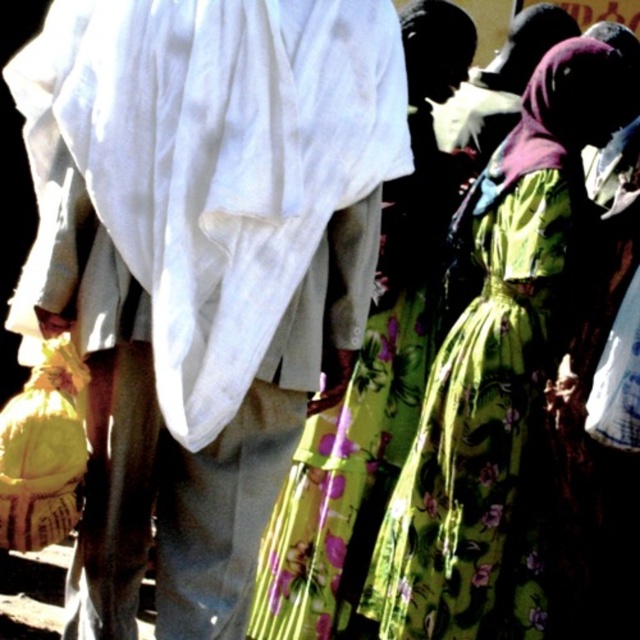
Does point (486, 538) come behind point (404, 236)?

That is False.

Can you confirm if floral green dress at center is wider than floral fabric dress at center?

Yes.

Where is `floral green dress at center`? The width and height of the screenshot is (640, 640). floral green dress at center is located at coordinates (497, 371).

You are a GUI agent. You are given a task and a screenshot of the screen. Output one action in this format:
    pyautogui.click(x=<x>, y=<y>)
    Task: Click on the floral green dress at center
    
    Given the screenshot: What is the action you would take?
    pyautogui.click(x=497, y=371)

Does white cotton cloth at center appear on the left side of floral green dress at center?

Yes, white cotton cloth at center is to the left of floral green dress at center.

Which of these two, white cotton cloth at center or floral green dress at center, stands taller?

floral green dress at center is taller.

You are a GUI agent. You are given a task and a screenshot of the screen. Output one action in this format:
    pyautogui.click(x=<x>, y=<y>)
    Task: Click on the white cotton cloth at center
    
    Given the screenshot: What is the action you would take?
    pyautogui.click(x=202, y=266)

Consider the image. Does white cotton cloth at center appear over floral fabric dress at center?

Incorrect, white cotton cloth at center is not positioned above floral fabric dress at center.

Is white cotton cloth at center to the left of floral fabric dress at center from the viewer's perspective?

Correct, you'll find white cotton cloth at center to the left of floral fabric dress at center.

At what (x,y) coordinates should I click in order to perform the action: click on white cotton cloth at center. Please return your answer as a coordinate pair (x, y). Looking at the image, I should click on (202, 266).

Where is `white cotton cloth at center`? white cotton cloth at center is located at coordinates (202, 266).